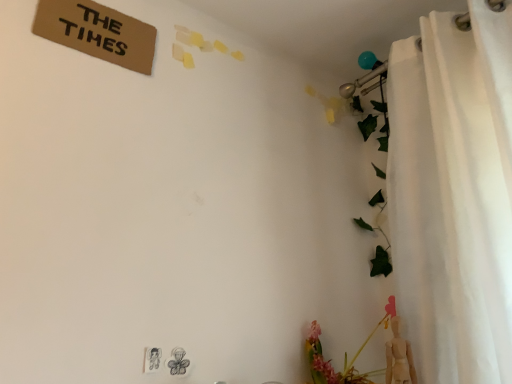
Question: Is pink matte floral arrangement at lower right smaller than white fabric curtain at right?

Choices:
 (A) yes
 (B) no

Answer: (A)

Question: Does pink matte floral arrangement at lower right come behind white fabric curtain at right?

Choices:
 (A) no
 (B) yes

Answer: (B)

Question: From the image's perspective, is pink matte floral arrangement at lower right on top of white fabric curtain at right?

Choices:
 (A) yes
 (B) no

Answer: (B)

Question: Considering the relative sizes of pink matte floral arrangement at lower right and white fabric curtain at right in the image provided, is pink matte floral arrangement at lower right taller than white fabric curtain at right?

Choices:
 (A) no
 (B) yes

Answer: (A)

Question: From a real-world perspective, is pink matte floral arrangement at lower right on white fabric curtain at right?

Choices:
 (A) yes
 (B) no

Answer: (B)

Question: Is pink matte floral arrangement at lower right closer to camera compared to white fabric curtain at right?

Choices:
 (A) yes
 (B) no

Answer: (B)

Question: Are white fabric curtain at right and pink matte floral arrangement at lower right far apart?

Choices:
 (A) no
 (B) yes

Answer: (A)

Question: Can we say white fabric curtain at right lies outside pink matte floral arrangement at lower right?

Choices:
 (A) no
 (B) yes

Answer: (B)

Question: Does white fabric curtain at right come in front of pink matte floral arrangement at lower right?

Choices:
 (A) yes
 (B) no

Answer: (A)

Question: From the image's perspective, is white fabric curtain at right below pink matte floral arrangement at lower right?

Choices:
 (A) no
 (B) yes

Answer: (A)

Question: Can you confirm if white fabric curtain at right is bigger than pink matte floral arrangement at lower right?

Choices:
 (A) yes
 (B) no

Answer: (A)

Question: Considering the relative positions of white fabric curtain at right and pink matte floral arrangement at lower right in the image provided, is white fabric curtain at right to the right of pink matte floral arrangement at lower right from the viewer's perspective?

Choices:
 (A) no
 (B) yes

Answer: (B)

Question: Looking at their shapes, would you say white fabric curtain at right is wider or thinner than pink matte floral arrangement at lower right?

Choices:
 (A) wide
 (B) thin

Answer: (A)